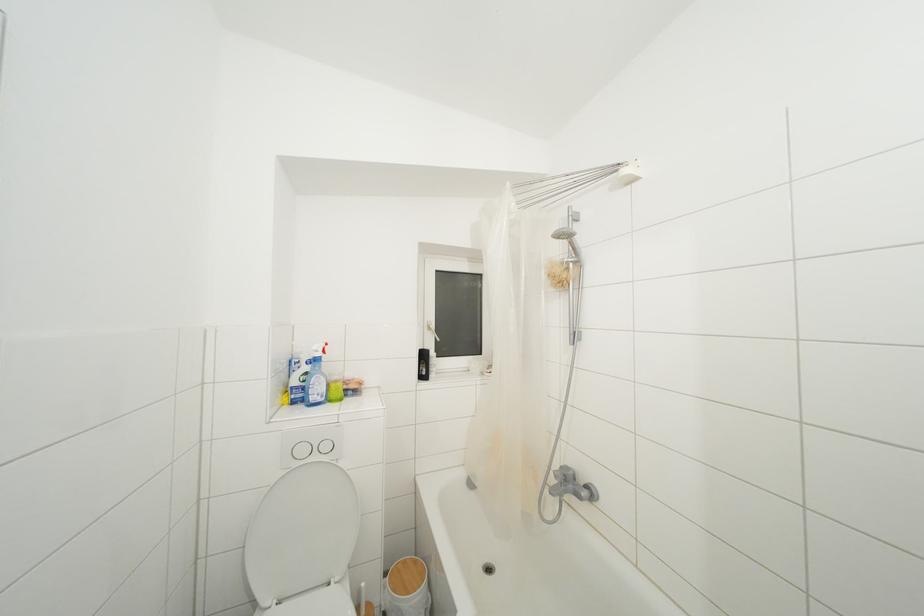
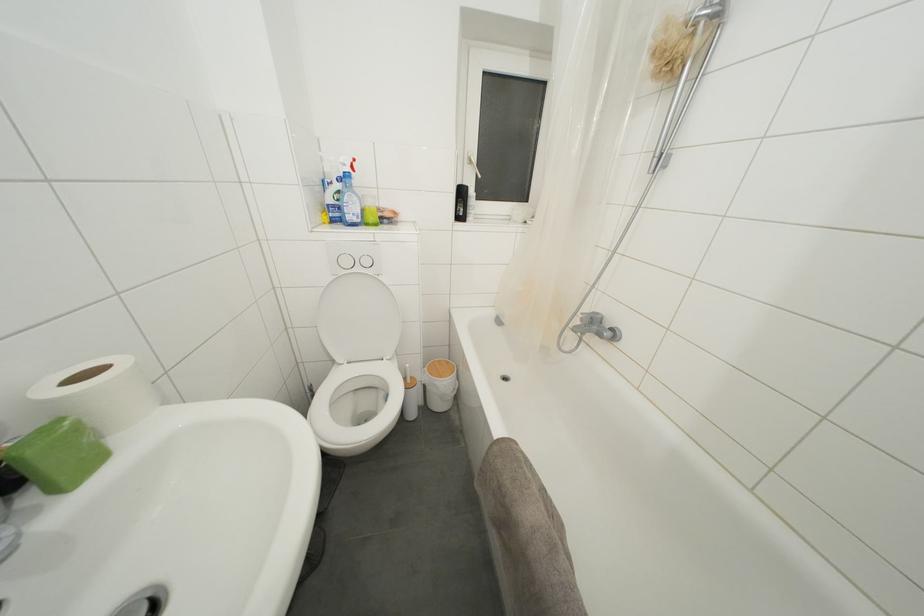
Question: How did the camera likely rotate?

Choices:
 (A) Left
 (B) Right
 (C) Up
 (D) Down

Answer: (D)